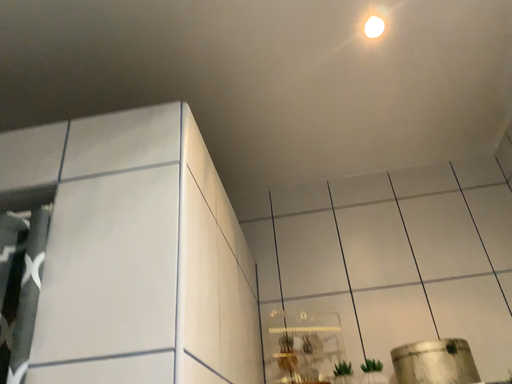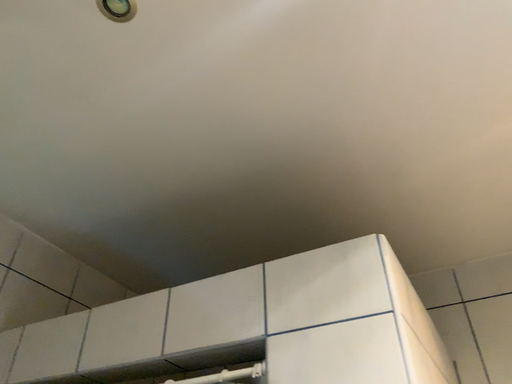
Question: How did the camera likely rotate when shooting the video?

Choices:
 (A) rotated right
 (B) rotated left

Answer: (B)